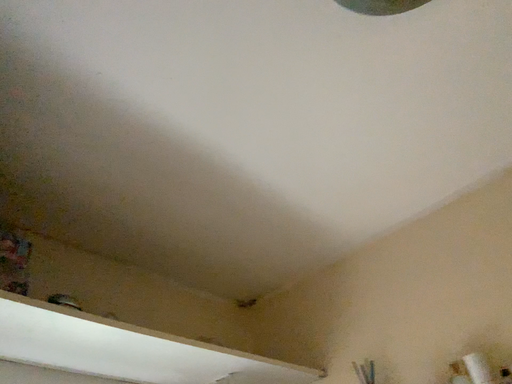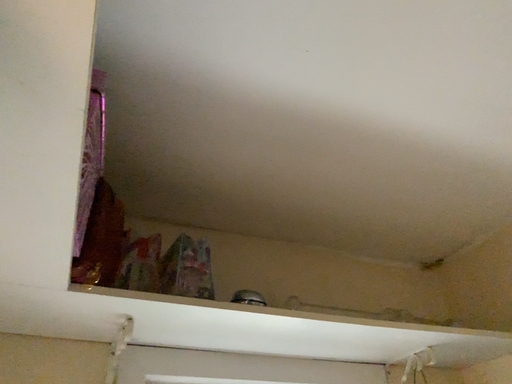
Question: Which way did the camera rotate in the video?

Choices:
 (A) rotated left
 (B) rotated right

Answer: (A)